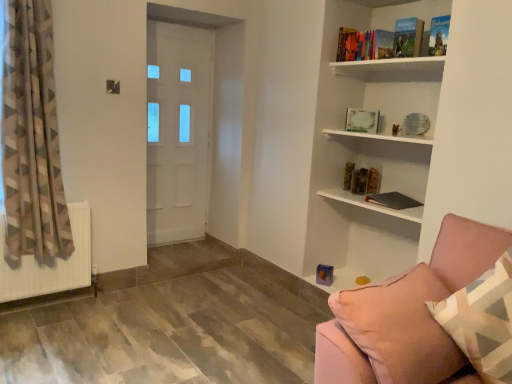
Question: Is hardcover book at upper right, arranged as the third book when viewed from the top, positioned behind geometric-patterned fabric curtain at left?

Choices:
 (A) yes
 (B) no

Answer: (A)

Question: Is hardcover book at upper right, arranged as the 4th book when ordered from the bottom, thinner than geometric-patterned fabric curtain at left?

Choices:
 (A) no
 (B) yes

Answer: (B)

Question: From the image's perspective, is hardcover book at upper right, arranged as the third book when viewed from the top, over geometric-patterned fabric curtain at left?

Choices:
 (A) yes
 (B) no

Answer: (A)

Question: Is there a large distance between hardcover book at upper right, arranged as the 4th book when ordered from the bottom, and geometric-patterned fabric curtain at left?

Choices:
 (A) no
 (B) yes

Answer: (B)

Question: Is geometric-patterned fabric curtain at left completely or partially inside hardcover book at upper right, arranged as the third book when viewed from the top?

Choices:
 (A) yes
 (B) no

Answer: (B)

Question: Can you confirm if hardcover book at upper right, arranged as the 4th book when ordered from the bottom, is positioned to the left of geometric-patterned fabric curtain at left?

Choices:
 (A) no
 (B) yes

Answer: (A)

Question: Is pink fabric pillow at lower right turned away from hardcover book at upper right, the sixth book positioned from the top?

Choices:
 (A) no
 (B) yes

Answer: (B)

Question: Is pink fabric pillow at lower right to the right of hardcover book at upper right, the first book when ordered from bottom to top, from the viewer's perspective?

Choices:
 (A) no
 (B) yes

Answer: (A)

Question: Is hardcover book at upper right, the first book when ordered from bottom to top, a part of pink fabric pillow at lower right?

Choices:
 (A) yes
 (B) no

Answer: (B)

Question: From a real-world perspective, is pink fabric pillow at lower right positioned over hardcover book at upper right, the sixth book positioned from the top, based on gravity?

Choices:
 (A) yes
 (B) no

Answer: (B)

Question: Is pink fabric pillow at lower right far from hardcover book at upper right, the sixth book positioned from the top?

Choices:
 (A) yes
 (B) no

Answer: (A)

Question: Does pink fabric pillow at lower right have a smaller size compared to hardcover book at upper right, the first book when ordered from bottom to top?

Choices:
 (A) yes
 (B) no

Answer: (B)

Question: Does hardcover book at upper right, the first book when ordered from bottom to top, have a smaller size compared to hardcover book at upper right, which ranks as the 2th book in top-to-bottom order?

Choices:
 (A) no
 (B) yes

Answer: (A)